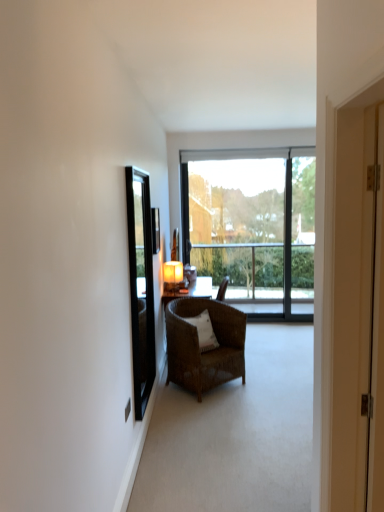
Question: Would you say white wooden door at right is a long distance from clear glass mirror at left?

Choices:
 (A) yes
 (B) no

Answer: (A)

Question: Can you confirm if white wooden door at right is positioned to the right of clear glass mirror at left?

Choices:
 (A) no
 (B) yes

Answer: (B)

Question: From a real-world perspective, does white wooden door at right sit lower than clear glass mirror at left?

Choices:
 (A) no
 (B) yes

Answer: (A)

Question: Considering the relative sizes of white wooden door at right and clear glass mirror at left in the image provided, is white wooden door at right taller than clear glass mirror at left?

Choices:
 (A) yes
 (B) no

Answer: (B)

Question: Is white wooden door at right smaller than clear glass mirror at left?

Choices:
 (A) yes
 (B) no

Answer: (B)

Question: Would you say matte black screen door at right is inside or outside white wooden door at right?

Choices:
 (A) outside
 (B) inside

Answer: (A)

Question: From the image's perspective, relative to white wooden door at right, is matte black screen door at right above or below?

Choices:
 (A) above
 (B) below

Answer: (A)

Question: From a real-world perspective, relative to white wooden door at right, is matte black screen door at right vertically above or below?

Choices:
 (A) below
 (B) above

Answer: (A)

Question: Is matte black screen door at right in front of or behind white wooden door at right in the image?

Choices:
 (A) front
 (B) behind

Answer: (B)

Question: Considering the positions of clear glass mirror at left and woven brown chair at center in the image, is clear glass mirror at left bigger or smaller than woven brown chair at center?

Choices:
 (A) big
 (B) small

Answer: (B)

Question: From the image's perspective, is clear glass mirror at left located above or below woven brown chair at center?

Choices:
 (A) below
 (B) above

Answer: (B)

Question: Which is correct: clear glass mirror at left is inside woven brown chair at center, or outside of it?

Choices:
 (A) inside
 (B) outside

Answer: (B)

Question: From a real-world perspective, is clear glass mirror at left above or below woven brown chair at center?

Choices:
 (A) below
 (B) above

Answer: (B)

Question: Is clear glass mirror at left in front of or behind white woven pillow at center in the image?

Choices:
 (A) front
 (B) behind

Answer: (A)

Question: From the image's perspective, is clear glass mirror at left located above or below white woven pillow at center?

Choices:
 (A) below
 (B) above

Answer: (B)